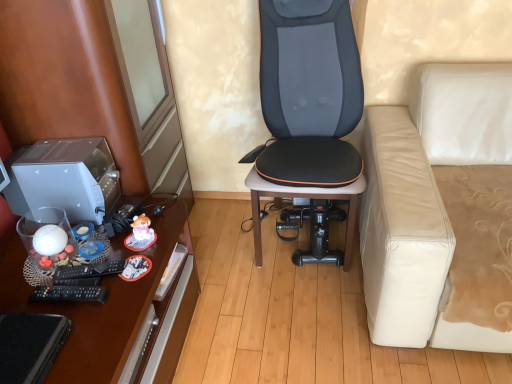
This screenshot has width=512, height=384. In order to click on free location to the left of black leather chair at center in this screenshot , I will do `click(224, 243)`.